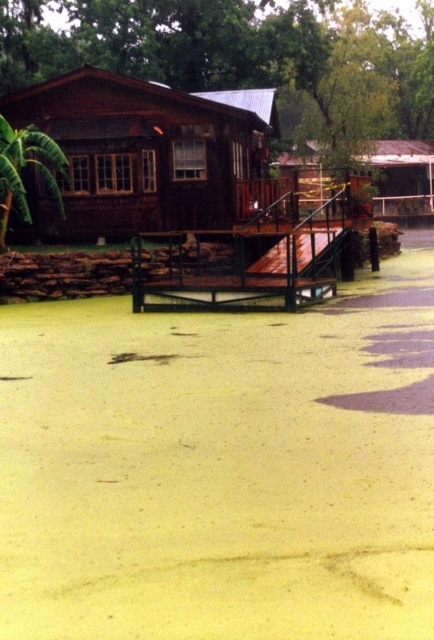
Question: Is wooden cabin at center wider than wooden hut at center?

Choices:
 (A) no
 (B) yes

Answer: (A)

Question: Does wooden hut at center appear under green leafy tree at left?

Choices:
 (A) yes
 (B) no

Answer: (B)

Question: Estimate the real-world distances between objects in this image. Which object is farther from the wooden cabin at center?

Choices:
 (A) green leafy tree at left
 (B) wooden hut at center

Answer: (B)

Question: Considering the real-world distances, which object is closest to the green leafy tree at left?

Choices:
 (A) wooden cabin at center
 (B) green leafy tree at upper center
 (C) wooden hut at center

Answer: (A)

Question: Which point is closer to the camera?

Choices:
 (A) (239, 180)
 (B) (3, 212)
 (C) (418, 173)

Answer: (B)

Question: Can you confirm if wooden hut at center is positioned to the left of green leafy tree at left?

Choices:
 (A) yes
 (B) no

Answer: (B)